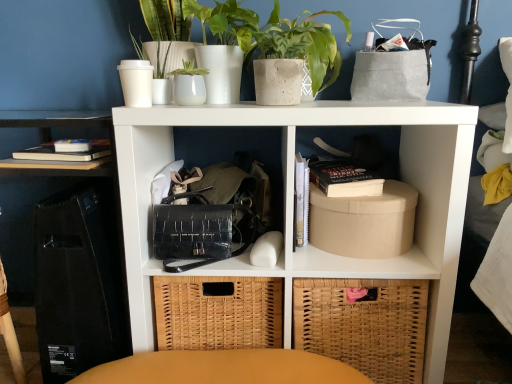
Question: Is black crocodile-patterned handbag at center located outside beige cardboard box at right?

Choices:
 (A) no
 (B) yes

Answer: (B)

Question: Considering the relative positions of black crocodile-patterned handbag at center and beige cardboard box at right in the image provided, is black crocodile-patterned handbag at center in front of beige cardboard box at right?

Choices:
 (A) no
 (B) yes

Answer: (B)

Question: From a real-world perspective, is black crocodile-patterned handbag at center located beneath beige cardboard box at right?

Choices:
 (A) yes
 (B) no

Answer: (B)

Question: Considering the relative sizes of black crocodile-patterned handbag at center and beige cardboard box at right in the image provided, is black crocodile-patterned handbag at center taller than beige cardboard box at right?

Choices:
 (A) yes
 (B) no

Answer: (A)

Question: Does black crocodile-patterned handbag at center have a greater width compared to beige cardboard box at right?

Choices:
 (A) yes
 (B) no

Answer: (A)

Question: From the image's perspective, is speckled concrete pot at upper center located above or below black crocodile-patterned handbag at center?

Choices:
 (A) above
 (B) below

Answer: (A)

Question: From their relative heights in the image, would you say speckled concrete pot at upper center is taller or shorter than black crocodile-patterned handbag at center?

Choices:
 (A) short
 (B) tall

Answer: (B)

Question: Relative to black crocodile-patterned handbag at center, is speckled concrete pot at upper center in front or behind?

Choices:
 (A) front
 (B) behind

Answer: (B)

Question: Is point (291, 56) closer or farther from the camera than point (186, 266)?

Choices:
 (A) farther
 (B) closer

Answer: (B)

Question: From the image's perspective, is woven brown basket at lower right located above or below hardcover black book at center-right?

Choices:
 (A) below
 (B) above

Answer: (A)

Question: From a real-world perspective, is woven brown basket at lower right above or below hardcover black book at center-right?

Choices:
 (A) below
 (B) above

Answer: (A)

Question: Is woven brown basket at lower right in front of or behind hardcover black book at center-right in the image?

Choices:
 (A) behind
 (B) front

Answer: (B)

Question: Considering the positions of woven brown basket at lower right and hardcover black book at center-right in the image, is woven brown basket at lower right taller or shorter than hardcover black book at center-right?

Choices:
 (A) short
 (B) tall

Answer: (B)

Question: From a real-world perspective, is white matte shelf at center, the first shelf positioned from the right, physically located above or below hardcover black book at center-right?

Choices:
 (A) above
 (B) below

Answer: (B)

Question: In terms of height, does white matte shelf at center, the second shelf from the top, look taller or shorter compared to hardcover black book at center-right?

Choices:
 (A) short
 (B) tall

Answer: (B)